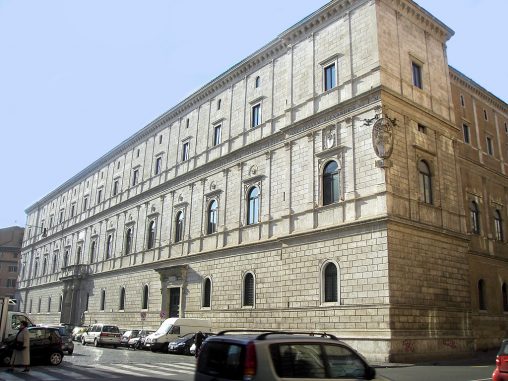
The width and height of the screenshot is (508, 381). I want to click on first story windows, so click(330, 282), click(249, 293), click(205, 297), click(144, 301), click(122, 301), click(102, 302).